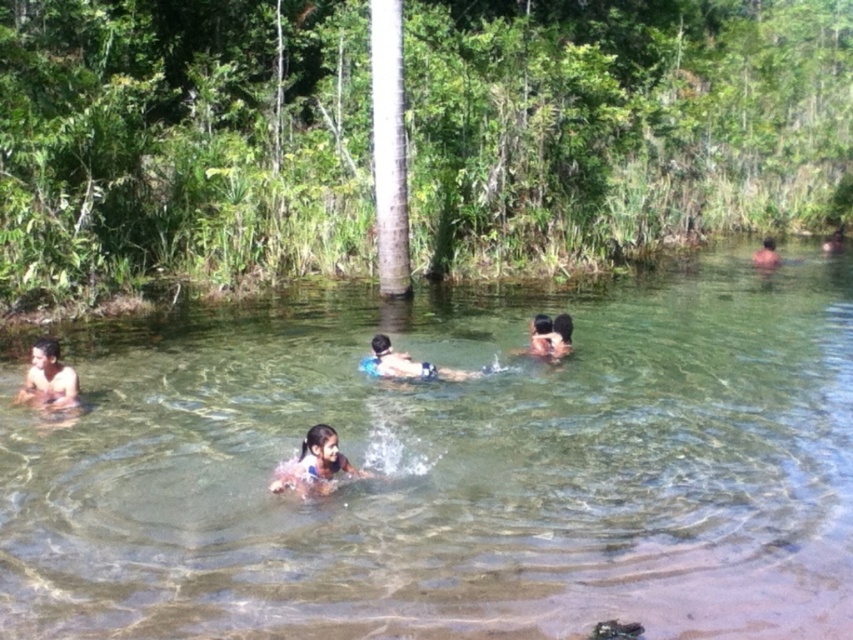
You are standing at the edge of the natural pool and want to locate two specific points in the water. The first point is at coordinates point (x=55, y=346) and the second is at point (x=763, y=240). Which of these two points is nearer to you?

Point (x=55, y=346) is closer to the camera than point (x=763, y=240), so the first point is nearer to you.